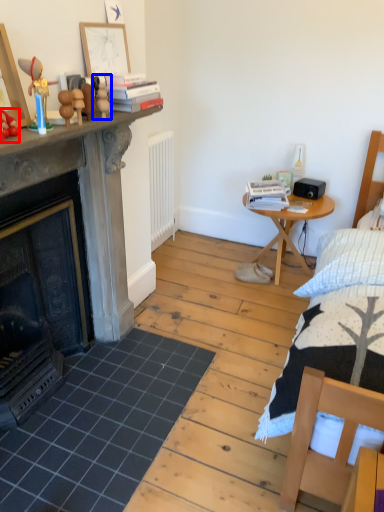
Question: Which point is closer to the camera, toy (highlighted by a red box) or toy (highlighted by a blue box)?

Choices:
 (A) toy
 (B) toy

Answer: (A)